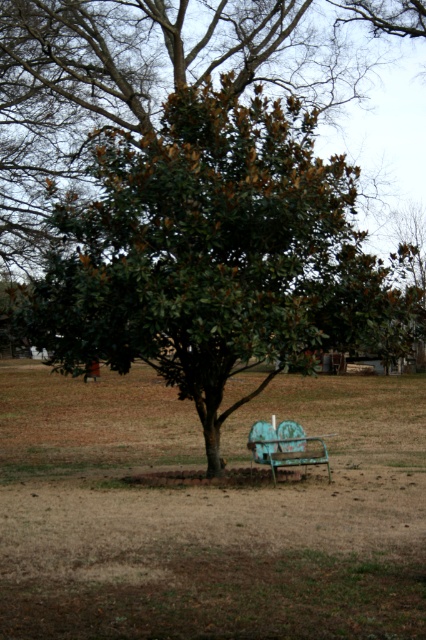
Can you confirm if green leafy tree at center is shorter than teal painted metal bench at lower center?

No.

Who is positioned more to the left, green leafy tree at center or teal painted metal bench at lower center?

green leafy tree at center is more to the left.

Who is more forward, (x=354, y=289) or (x=296, y=442)?

Point (x=354, y=289) is in front.

The image size is (426, 640). Find the location of `green leafy tree at center`. green leafy tree at center is located at coordinates (215, 256).

Does brown dry grass at center have a greater width compared to teal painted metal bench at lower center?

Yes, brown dry grass at center is wider than teal painted metal bench at lower center.

Is the position of brown dry grass at center more distant than that of teal painted metal bench at lower center?

No, brown dry grass at center is in front of teal painted metal bench at lower center.

Is point (60, 556) positioned after point (294, 429)?

No.

You are a GUI agent. You are given a task and a screenshot of the screen. Output one action in this format:
    pyautogui.click(x=<x>, y=<y>)
    Task: Click on the brown dry grass at center
    
    Given the screenshot: What is the action you would take?
    (x=207, y=513)

Can you confirm if brown dry grass at center is thinner than green leafy tree at center?

→ No, brown dry grass at center is not thinner than green leafy tree at center.

Does brown dry grass at center appear under green leafy tree at center?

Yes.

What are the coordinates of `brown dry grass at center` in the screenshot? It's located at (207, 513).

Identify the location of brown dry grass at center. (207, 513).